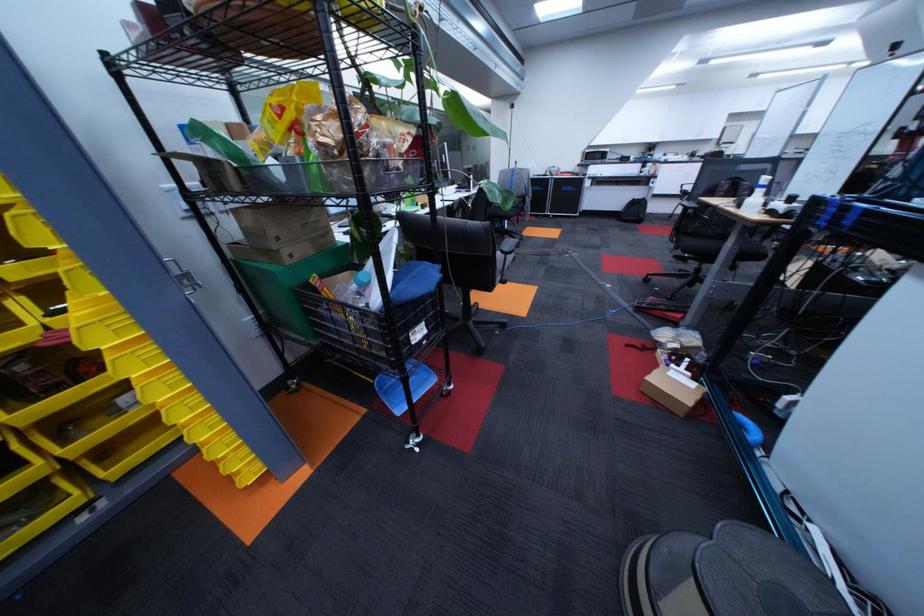
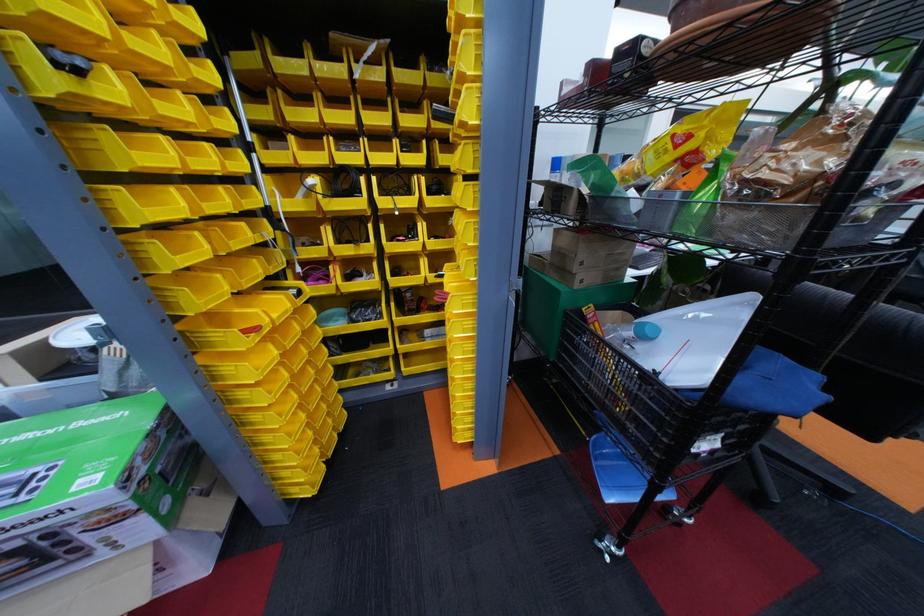
Question: Based on the continuous images, in which direction is the camera rotating? Reply with the corresponding letter.

Choices:
 (A) Left
 (B) Right
 (C) Up
 (D) Down

Answer: (A)